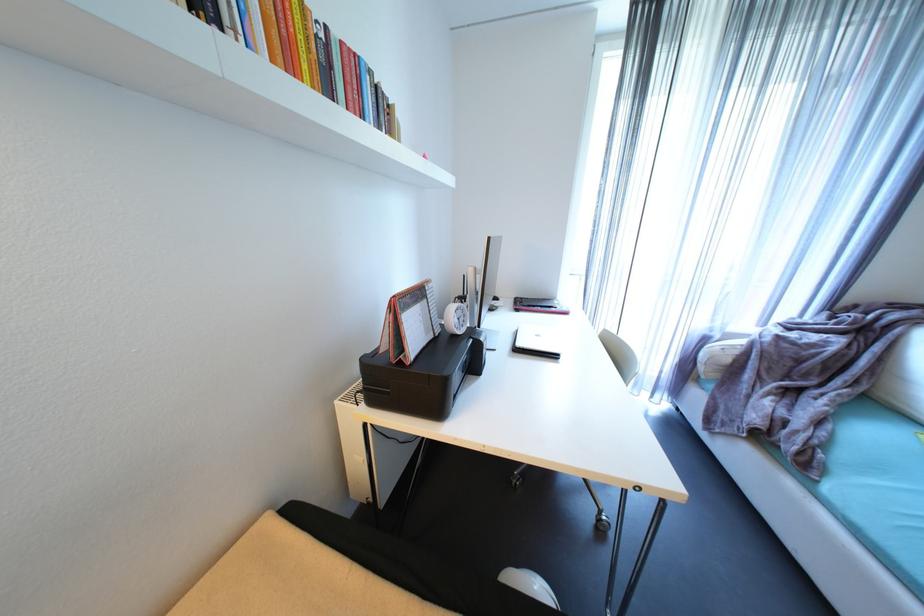
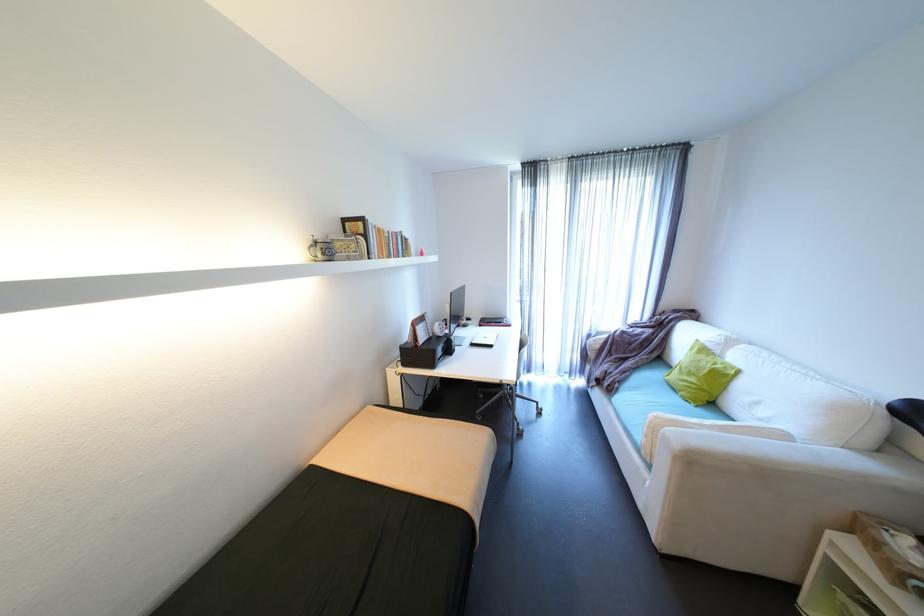
Find the pixel in the second image that matches [496,238] in the first image.

(458, 294)